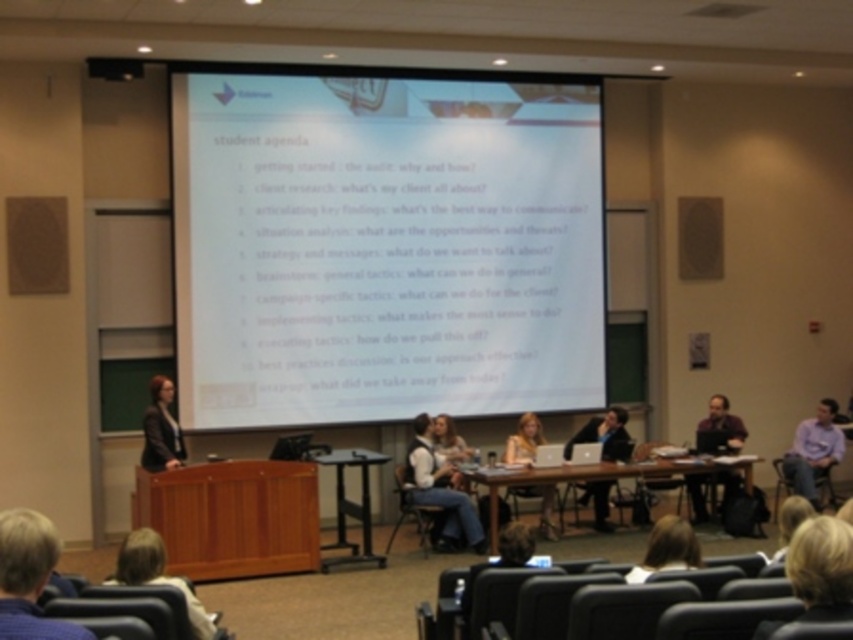
Question: Among these objects, which one is farthest from the camera?

Choices:
 (A) metallic silver table at center
 (B) dark gray suit at center

Answer: (B)

Question: Which of the following is the closest to the observer?

Choices:
 (A) purple matte shirt at lower right
 (B) matte black blazer at left
 (C) metallic silver table at center
 (D) dark gray suit at center

Answer: (C)

Question: Does wooden table at center appear over dark gray suit at center?

Choices:
 (A) no
 (B) yes

Answer: (A)

Question: From the image, what is the correct spatial relationship of white matte projector screen at upper center in relation to metallic silver table at center?

Choices:
 (A) right
 (B) left

Answer: (B)

Question: Which of the following is the farthest from the observer?

Choices:
 (A) 831,445
 (B) 328,454

Answer: (A)

Question: Is light blue shirt at right bigger than matte black blazer at left?

Choices:
 (A) no
 (B) yes

Answer: (B)